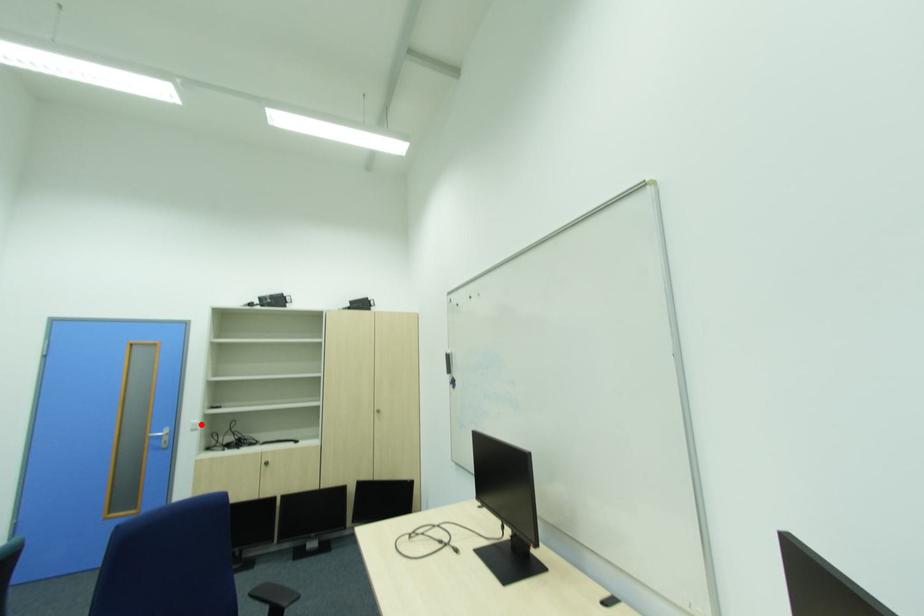
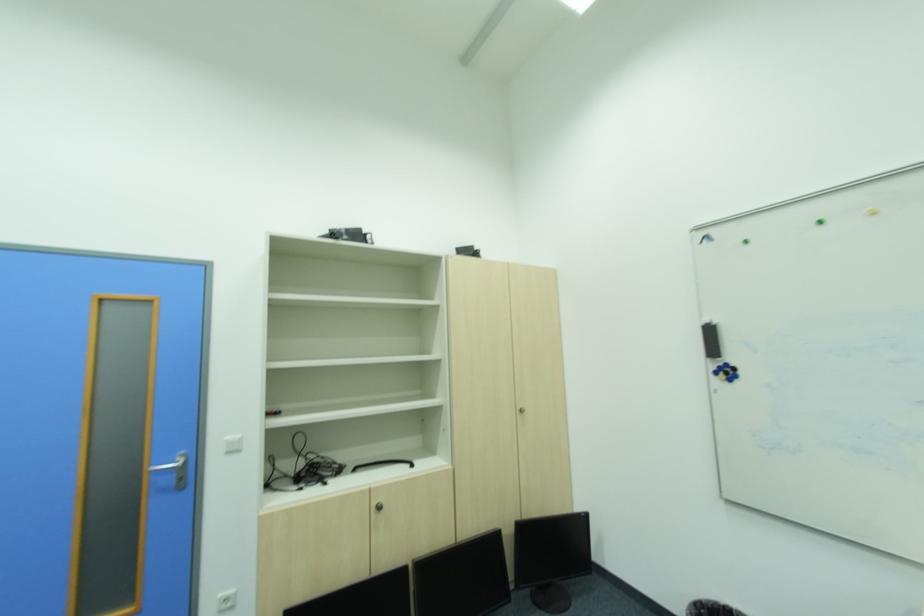
Where in the second image is the point corresponding to the highlighted location from the first image?

(237, 443)